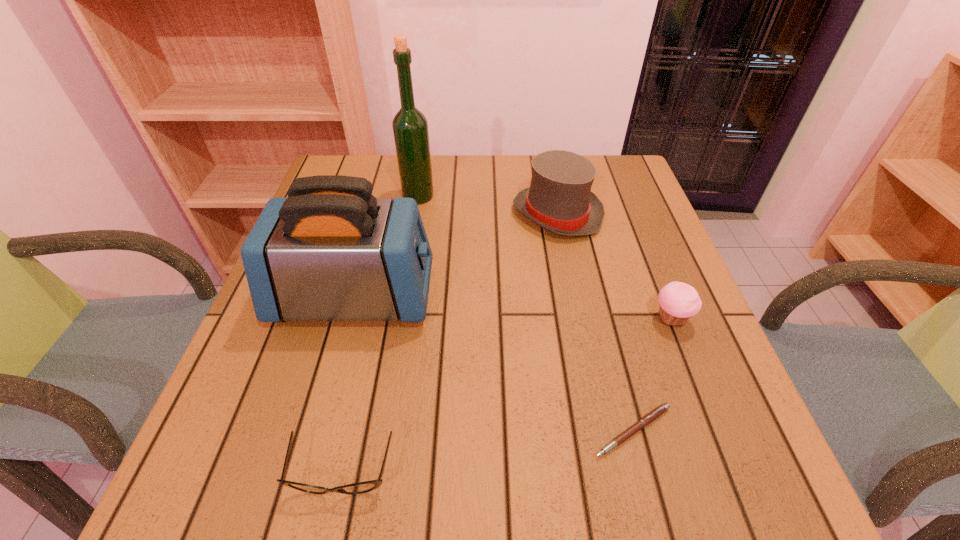
You are a GUI agent. You are given a task and a screenshot of the screen. Output one action in this format:
    pyautogui.click(x=<x>, y=<y>)
    Task: Click on the liquor
    The width and height of the screenshot is (960, 540).
    Given the screenshot: What is the action you would take?
    pyautogui.click(x=410, y=127)

Locate an element on the screen. This screenshot has width=960, height=540. toaster is located at coordinates pyautogui.click(x=331, y=251).

Identify the location of the third tallest object. (559, 199).

This screenshot has width=960, height=540. I want to click on the rightmost object, so click(x=678, y=301).

Locate an element on the screen. The width and height of the screenshot is (960, 540). the fourth tallest object is located at coordinates (678, 301).

The image size is (960, 540). In order to click on spectacles in this screenshot , I will do `click(362, 487)`.

You are a GUI agent. You are given a task and a screenshot of the screen. Output one action in this format:
    pyautogui.click(x=<x>, y=<y>)
    Task: Click on the pen
    The height and width of the screenshot is (540, 960).
    Given the screenshot: What is the action you would take?
    pyautogui.click(x=654, y=414)

At what (x,y) coordinates should I click in order to perform the action: click on vacant space located on the front of the tallest object. Please return your answer as a coordinate pair (x, y). The width and height of the screenshot is (960, 540). Looking at the image, I should click on (412, 234).

This screenshot has width=960, height=540. I want to click on blank space located 0.090m on the front-facing side of the toaster, so coord(474,297).

Locate an element on the screen. This screenshot has height=540, width=960. free space located 0.370m on the front of the fourth shortest object is located at coordinates (590, 376).